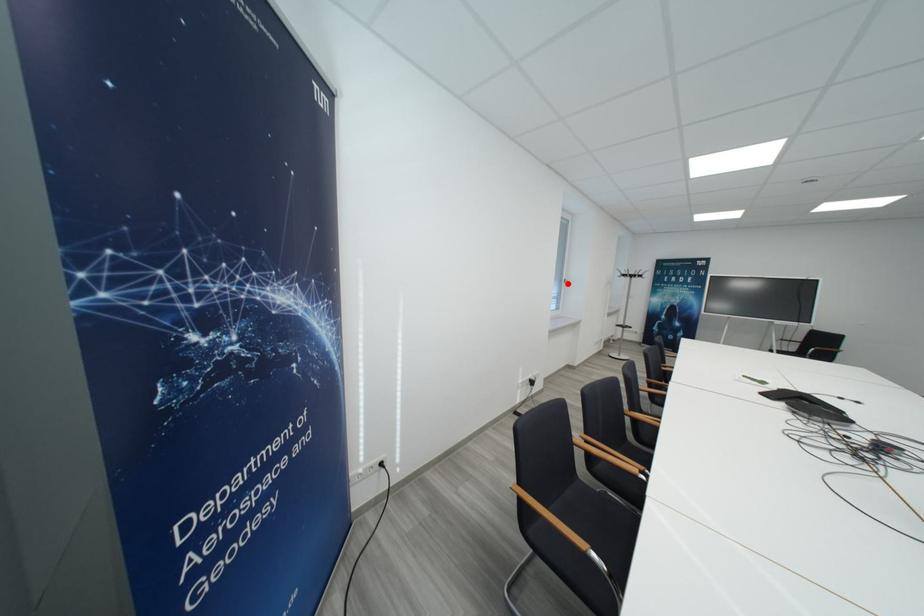
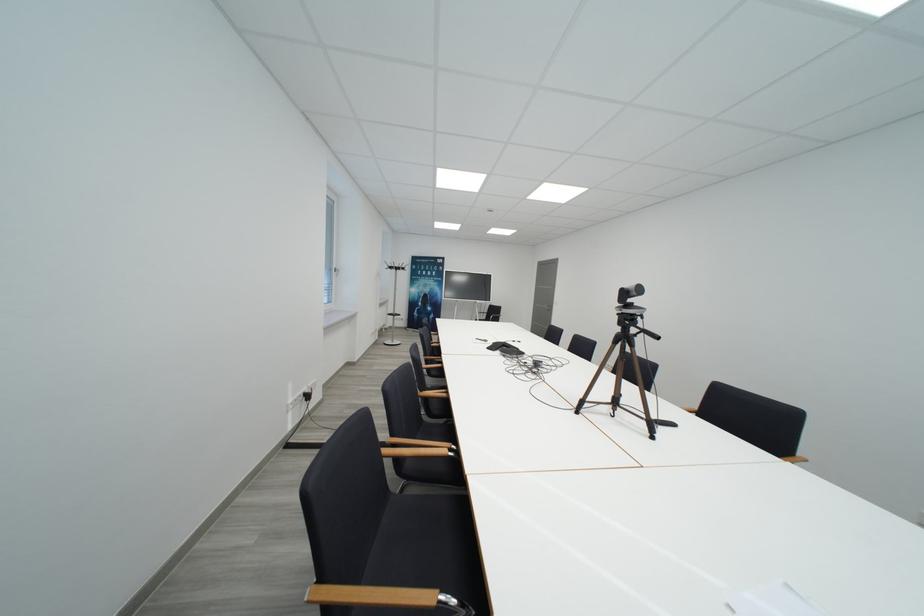
Question: I am providing you with two images of the same scene from different viewpoints. In image1, a red point is highlighted. Considering the same 3D point in image2, which of the following is correct?

Choices:
 (A) It is closer
 (B) It is farther

Answer: (B)